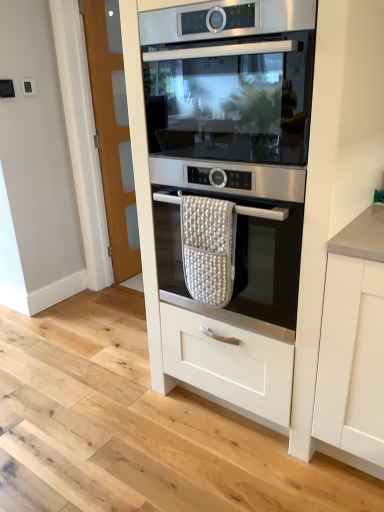
Question: Considering the relative sizes of stainless steel oven at center and satin silver oven at center, the 1th oven from the bottom, in the image provided, is stainless steel oven at center thinner than satin silver oven at center, the 1th oven from the bottom,?

Choices:
 (A) no
 (B) yes

Answer: (A)

Question: Is stainless steel oven at center outside satin silver oven at center, the 1th oven from the bottom?

Choices:
 (A) no
 (B) yes

Answer: (B)

Question: From a real-world perspective, is stainless steel oven at center positioned under satin silver oven at center, marked as the second oven in a top-to-bottom arrangement, based on gravity?

Choices:
 (A) no
 (B) yes

Answer: (A)

Question: Is stainless steel oven at center shorter than satin silver oven at center, marked as the second oven in a top-to-bottom arrangement?

Choices:
 (A) yes
 (B) no

Answer: (A)

Question: Is satin silver oven at center, the 1th oven from the bottom, inside stainless steel oven at center?

Choices:
 (A) no
 (B) yes

Answer: (A)

Question: Is satin silver oven at center, the 1th oven from the bottom, bigger or smaller than stainless steel oven at center, marked as the second oven in a bottom-to-top arrangement?

Choices:
 (A) big
 (B) small

Answer: (B)

Question: Is satin silver oven at center, the 1th oven from the bottom, to the left or to the right of stainless steel oven at center, which is counted as the first oven, starting from the top, in the image?

Choices:
 (A) left
 (B) right

Answer: (A)

Question: Is satin silver oven at center, the 1th oven from the bottom, taller or shorter than stainless steel oven at center, which is counted as the first oven, starting from the top?

Choices:
 (A) tall
 (B) short

Answer: (B)

Question: Does point (249, 270) appear closer or farther from the camera than point (233, 136)?

Choices:
 (A) farther
 (B) closer

Answer: (A)

Question: In the image, is white textured oven mitt at center on the left side or the right side of satin silver oven at center, marked as the second oven in a top-to-bottom arrangement?

Choices:
 (A) right
 (B) left

Answer: (B)

Question: Is white textured oven mitt at center spatially inside satin silver oven at center, the 1th oven from the bottom, or outside of it?

Choices:
 (A) inside
 (B) outside

Answer: (A)

Question: Is white textured oven mitt at center in front of or behind satin silver oven at center, the 1th oven from the bottom, in the image?

Choices:
 (A) front
 (B) behind

Answer: (B)

Question: From a real-world perspective, relative to satin silver oven at center, marked as the second oven in a top-to-bottom arrangement, is white textured oven mitt at center vertically above or below?

Choices:
 (A) above
 (B) below

Answer: (B)

Question: Is satin silver oven at center, the 1th oven from the bottom, taller or shorter than white textured oven mitt at center?

Choices:
 (A) tall
 (B) short

Answer: (A)

Question: Based on their positions, is satin silver oven at center, marked as the second oven in a top-to-bottom arrangement, located to the left or right of white textured oven mitt at center?

Choices:
 (A) left
 (B) right

Answer: (B)